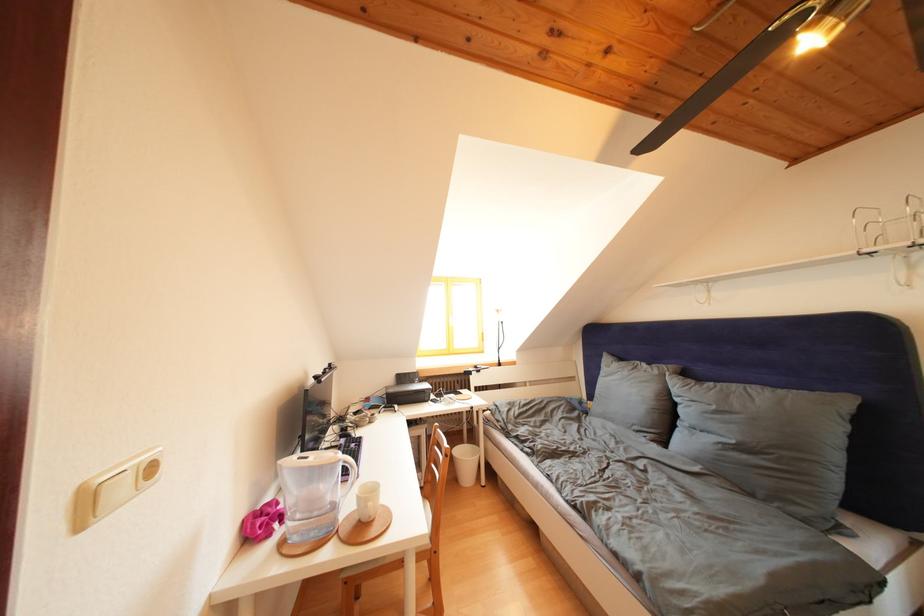
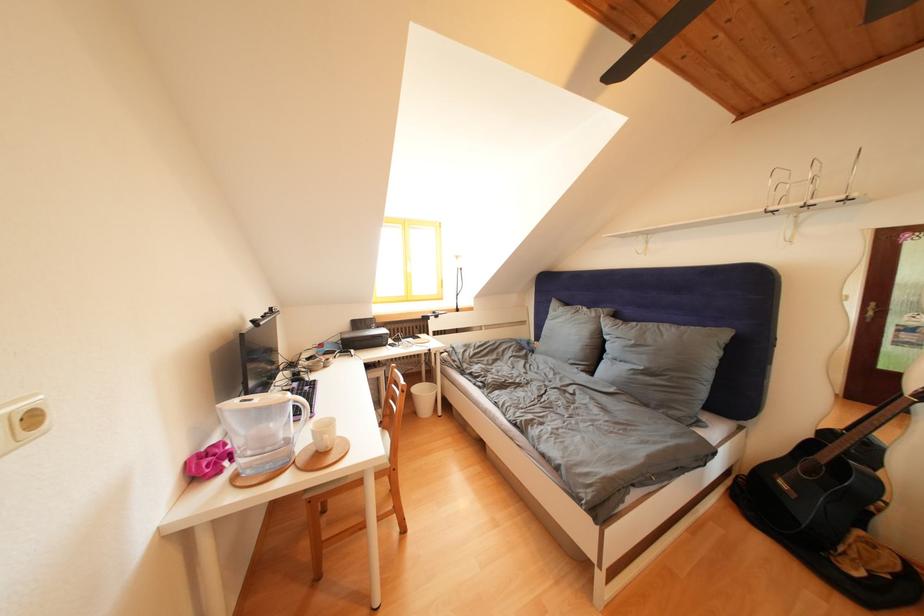
Find the pixel in the second image that matches point 435,546 in the first image.

(395, 467)